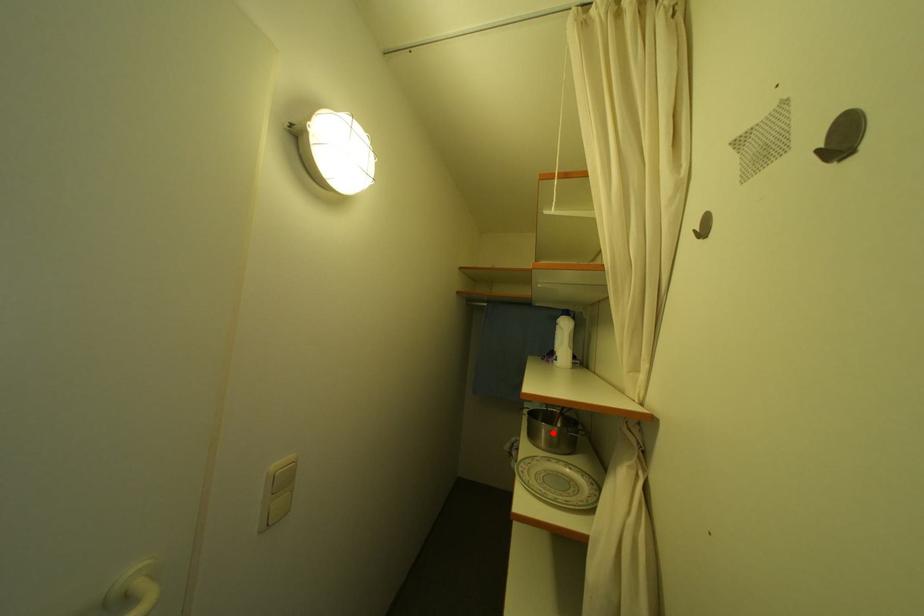
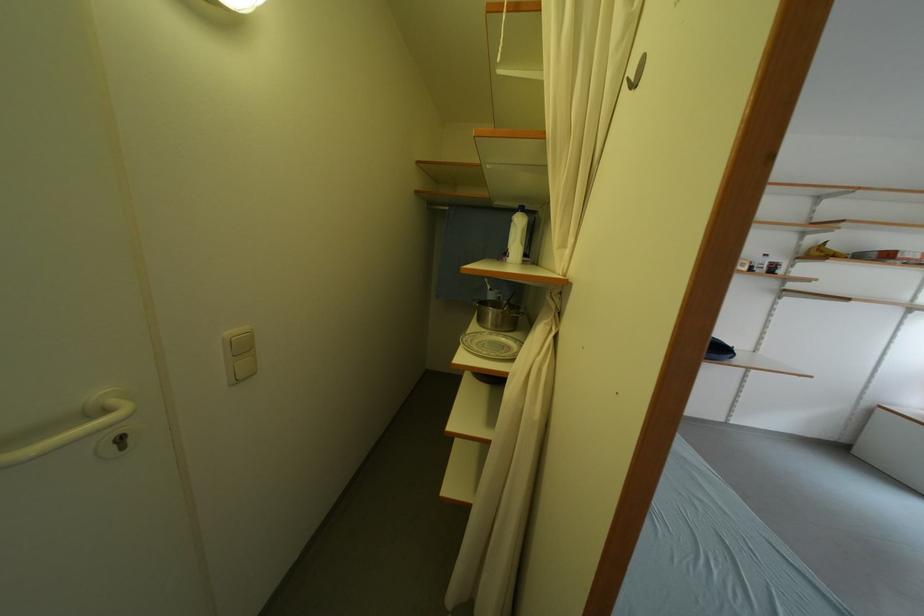
Find the pixel in the second image that matches the highlighted location in the first image.

(500, 317)